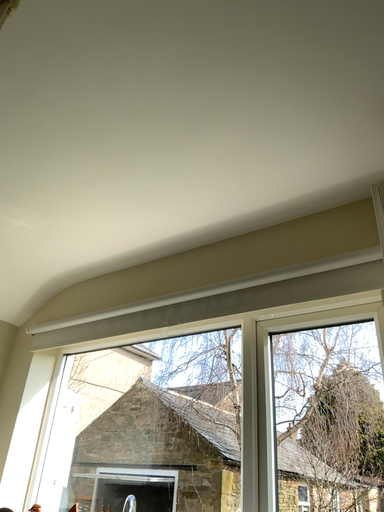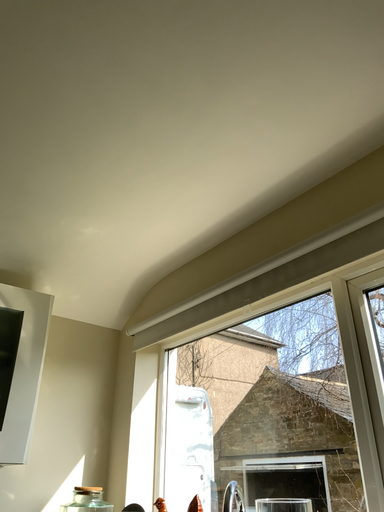
Question: How did the camera likely rotate when shooting the video?

Choices:
 (A) rotated left
 (B) rotated right

Answer: (A)